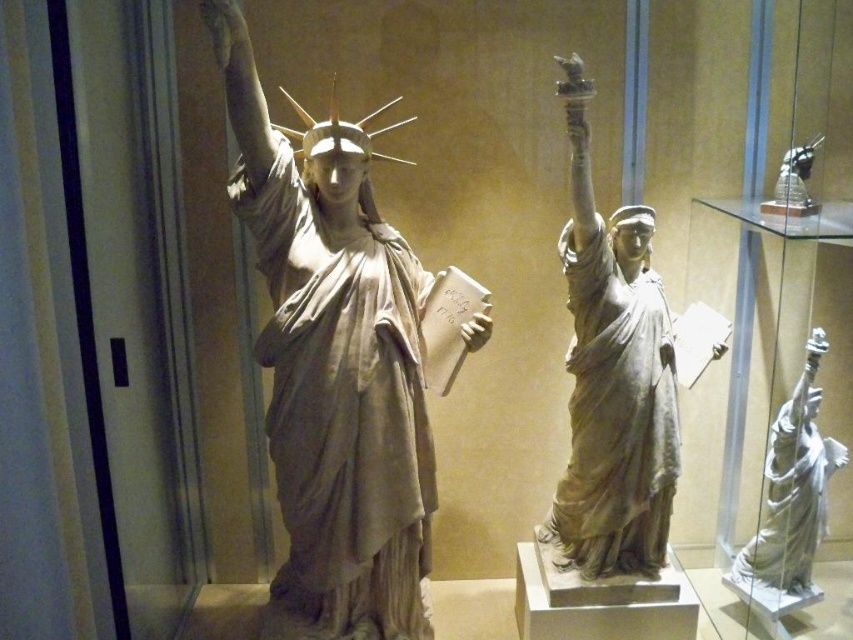
Question: Which point is farther to the camera?

Choices:
 (A) (624, 218)
 (B) (785, 564)
 (C) (412, 358)

Answer: (B)

Question: Observing the image, what is the correct spatial positioning of white marble statue at left in reference to satin gold statue at upper right?

Choices:
 (A) right
 (B) left

Answer: (B)

Question: Is white marble statue at left wider than matte gray statue at center?

Choices:
 (A) yes
 (B) no

Answer: (A)

Question: Is white marble statue at left closer to camera compared to satin gold statue at upper right?

Choices:
 (A) yes
 (B) no

Answer: (A)

Question: Which of the following is the closest to the observer?

Choices:
 (A) (393, 324)
 (B) (781, 516)
 (C) (624, 227)
 (D) (810, 204)

Answer: (A)

Question: Based on their relative distances, which object is farther from the white marble statue at left?

Choices:
 (A) white marble statue at right
 (B) satin gold statue at upper right

Answer: (B)